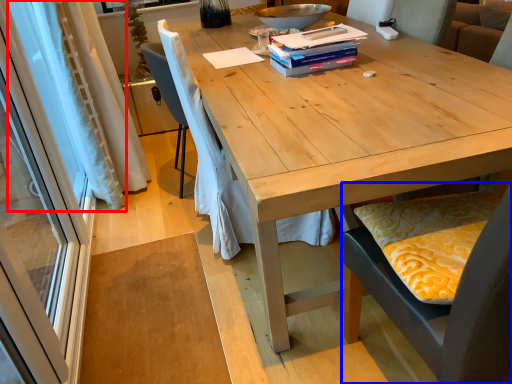
Question: Which object is further to the camera taking this photo, curtain (highlighted by a red box) or chair (highlighted by a blue box)?

Choices:
 (A) curtain
 (B) chair

Answer: (A)